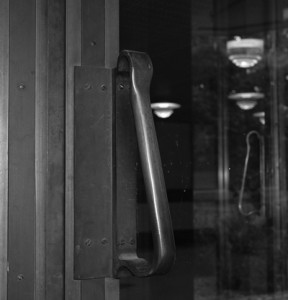
Where is `dark room`? dark room is located at coordinates (187, 183).